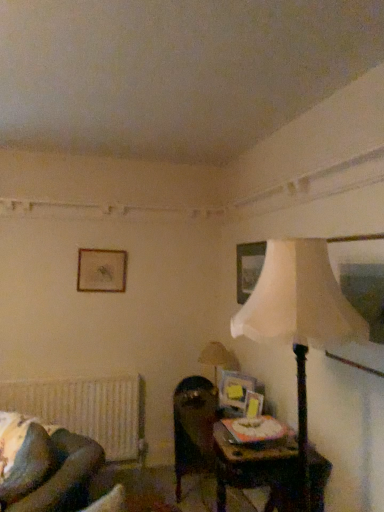
Question: Is dark brown leather swivel chair at center positioned with its back to dark brown leather rocking chair at lower left?

Choices:
 (A) no
 (B) yes

Answer: (A)

Question: Is dark brown leather swivel chair at center thinner than dark brown leather rocking chair at lower left?

Choices:
 (A) no
 (B) yes

Answer: (B)

Question: Is dark brown leather swivel chair at center at the left side of dark brown leather rocking chair at lower left?

Choices:
 (A) yes
 (B) no

Answer: (B)

Question: From a real-world perspective, is dark brown leather swivel chair at center below dark brown leather rocking chair at lower left?

Choices:
 (A) no
 (B) yes

Answer: (B)

Question: Is the position of dark brown leather swivel chair at center less distant than that of dark brown leather rocking chair at lower left?

Choices:
 (A) yes
 (B) no

Answer: (B)

Question: From a real-world perspective, is wooden picture frame at upper center, the 3th picture frame from the bottom, physically located above or below matte gold picture frame at upper center, the 1th picture frame from the top?

Choices:
 (A) above
 (B) below

Answer: (B)

Question: Do you think wooden picture frame at upper center, positioned as the third picture frame in front-to-back order, is within matte gold picture frame at upper center, the 1th picture frame from the top, or outside of it?

Choices:
 (A) inside
 (B) outside

Answer: (B)

Question: In terms of height, does wooden picture frame at upper center, positioned as the third picture frame in front-to-back order, look taller or shorter compared to matte gold picture frame at upper center, which is counted as the 4th picture frame, starting from the bottom?

Choices:
 (A) tall
 (B) short

Answer: (A)

Question: Considering their positions, is wooden picture frame at upper center, which is the second picture frame in top-to-bottom order, located in front of or behind matte gold picture frame at upper center, which is counted as the 4th picture frame, starting from the bottom?

Choices:
 (A) front
 (B) behind

Answer: (A)

Question: In the image, is wooden picture frame at upper center, the 3th picture frame from the bottom, on the left side or the right side of white textured radiator at lower left?

Choices:
 (A) right
 (B) left

Answer: (A)

Question: Would you say wooden picture frame at upper center, placed as the fourth picture frame when sorted from left to right, is inside or outside white textured radiator at lower left?

Choices:
 (A) outside
 (B) inside

Answer: (A)

Question: Is wooden picture frame at upper center, which is the second picture frame in top-to-bottom order, in front of or behind white textured radiator at lower left in the image?

Choices:
 (A) front
 (B) behind

Answer: (A)

Question: Looking at the image, does wooden picture frame at upper center, positioned as the third picture frame in front-to-back order, seem bigger or smaller compared to white textured radiator at lower left?

Choices:
 (A) small
 (B) big

Answer: (A)

Question: Considering the positions of point (109, 435) and point (258, 394), is point (109, 435) closer or farther from the camera than point (258, 394)?

Choices:
 (A) closer
 (B) farther

Answer: (B)

Question: Is white textured radiator at lower left bigger or smaller than wooden picture frame at center, which is counted as the 3th picture frame, starting from the left?

Choices:
 (A) small
 (B) big

Answer: (B)